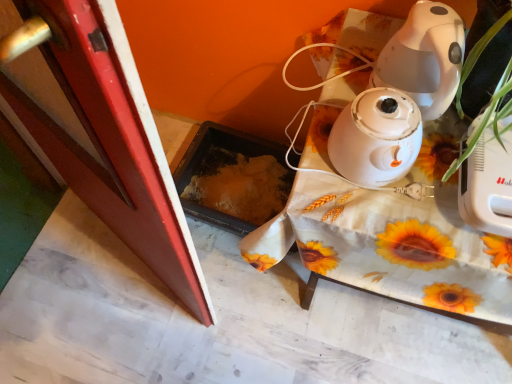
Question: Is point (487, 34) positioned closer to the camera than point (387, 105)?

Choices:
 (A) closer
 (B) farther

Answer: (A)

Question: From a real-world perspective, is green leafy plant at right above or below white glossy humidifier at center?

Choices:
 (A) above
 (B) below

Answer: (A)

Question: Which of these objects is positioned farthest from the white fabric-covered table at upper right?

Choices:
 (A) green leafy plant at right
 (B) white glossy humidifier at center
 (C) smooth red screen door at left

Answer: (C)

Question: Estimate the real-world distances between objects in this image. Which object is closer to the smooth red screen door at left?

Choices:
 (A) white glossy humidifier at center
 (B) green leafy plant at right
 (C) white fabric-covered table at upper right

Answer: (C)